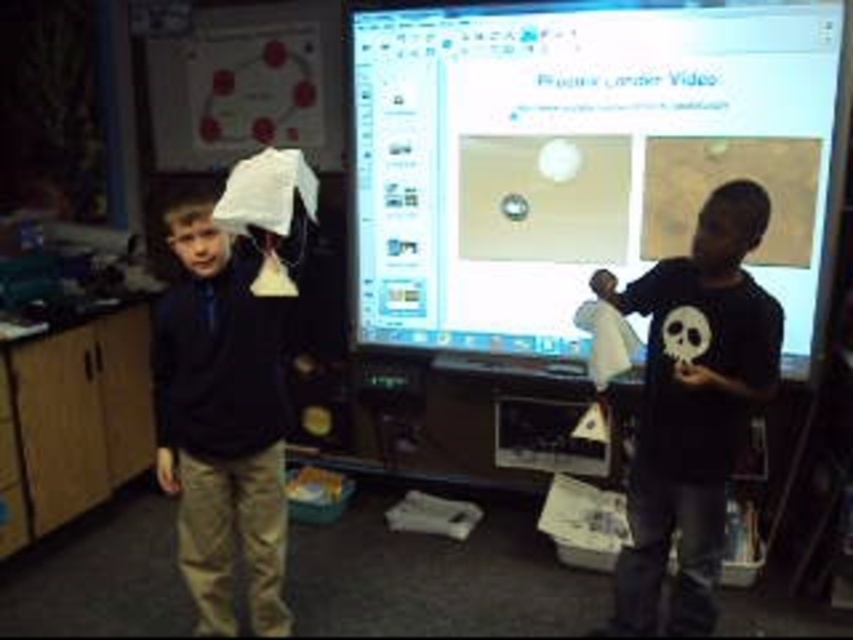
From the picture: Which is more to the right, matte black jacket at left or black matte shirt at right?

From the viewer's perspective, black matte shirt at right appears more on the right side.

Can you confirm if matte black jacket at left is taller than black matte shirt at right?

In fact, matte black jacket at left may be shorter than black matte shirt at right.

This screenshot has height=640, width=853. Describe the element at coordinates (222, 412) in the screenshot. I see `matte black jacket at left` at that location.

Find the location of `matte black jacket at left`. matte black jacket at left is located at coordinates (222, 412).

Is white glossy monitor at center above black matte shirt at right?

Yes.

Is white glossy monitor at center below black matte shirt at right?

Actually, white glossy monitor at center is above black matte shirt at right.

Who is more forward, (555, 113) or (682, 369)?

Point (682, 369)

Identify the location of white glossy monitor at center. The height and width of the screenshot is (640, 853). (582, 157).

Is white glossy monitor at center wider than matte black jacket at left?

Yes.

What do you see at coordinates (582, 157) in the screenshot? Image resolution: width=853 pixels, height=640 pixels. I see `white glossy monitor at center` at bounding box center [582, 157].

This screenshot has height=640, width=853. What are the coordinates of `white glossy monitor at center` in the screenshot? It's located at (582, 157).